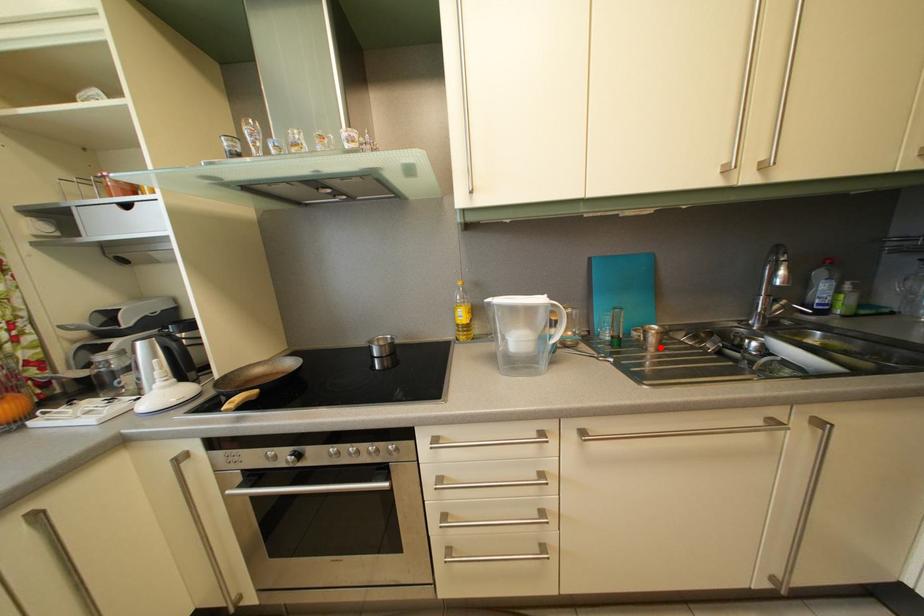
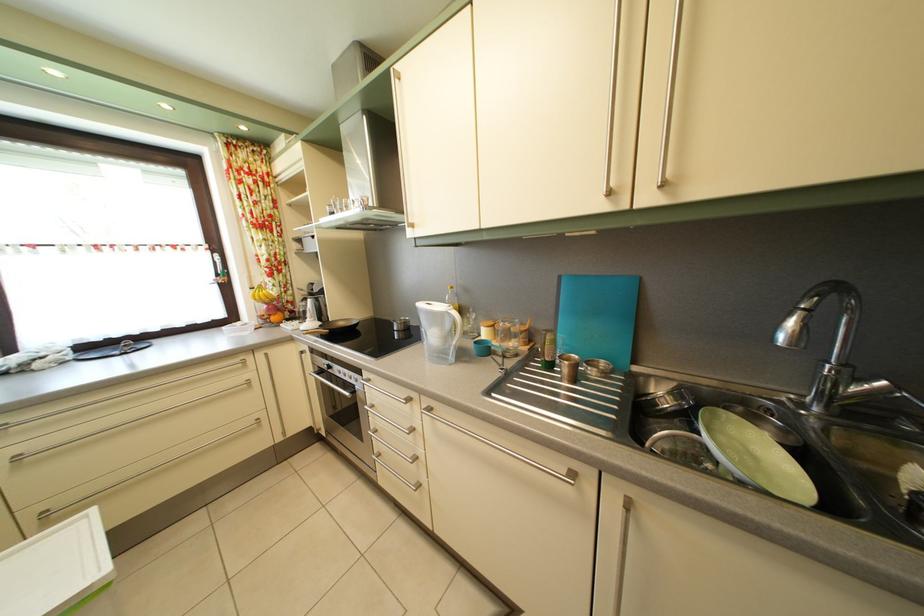
Find the pixel in the second image that matches the highlighted location in the first image.

(574, 378)